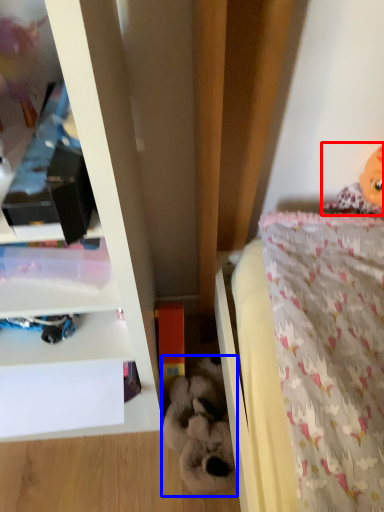
Question: Which object is closer to the camera taking this photo, doll (highlighted by a red box) or toy (highlighted by a blue box)?

Choices:
 (A) doll
 (B) toy

Answer: (A)